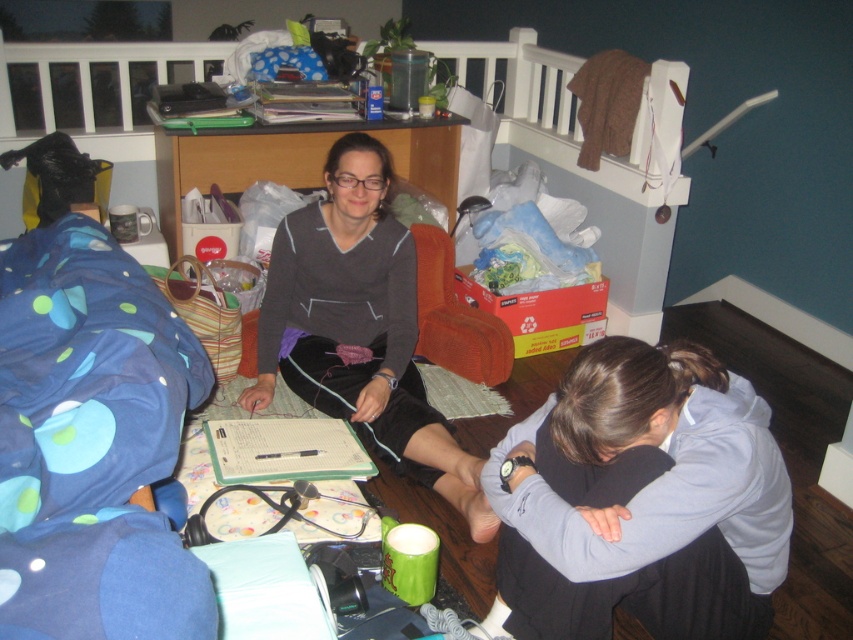
Does gray fleece hoodie at lower right have a lesser height compared to matte gray sweater at center?

Correct, gray fleece hoodie at lower right is not as tall as matte gray sweater at center.

How far apart are gray fleece hoodie at lower right and matte gray sweater at center?

They are 27.26 inches apart.

Is point (769, 486) more distant than point (396, 396)?

No, (769, 486) is in front of (396, 396).

Where is `gray fleece hoodie at lower right`? The image size is (853, 640). gray fleece hoodie at lower right is located at coordinates (640, 500).